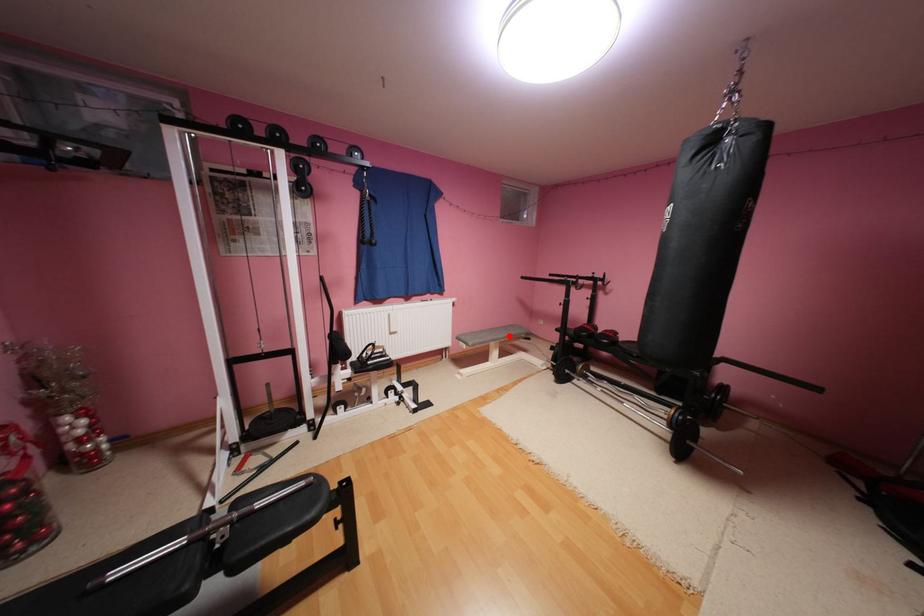
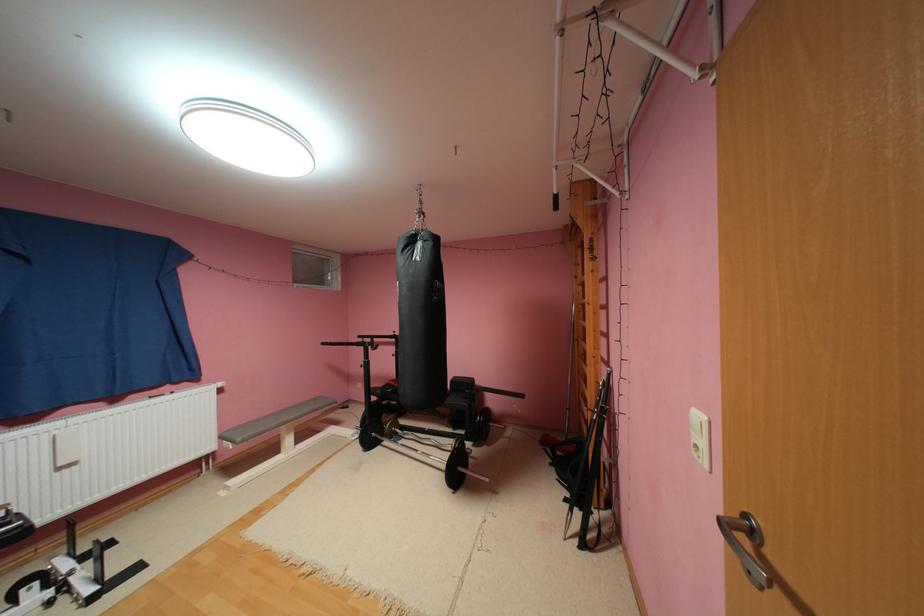
Find the pixel in the second image that matches the highlighted location in the first image.

(300, 416)